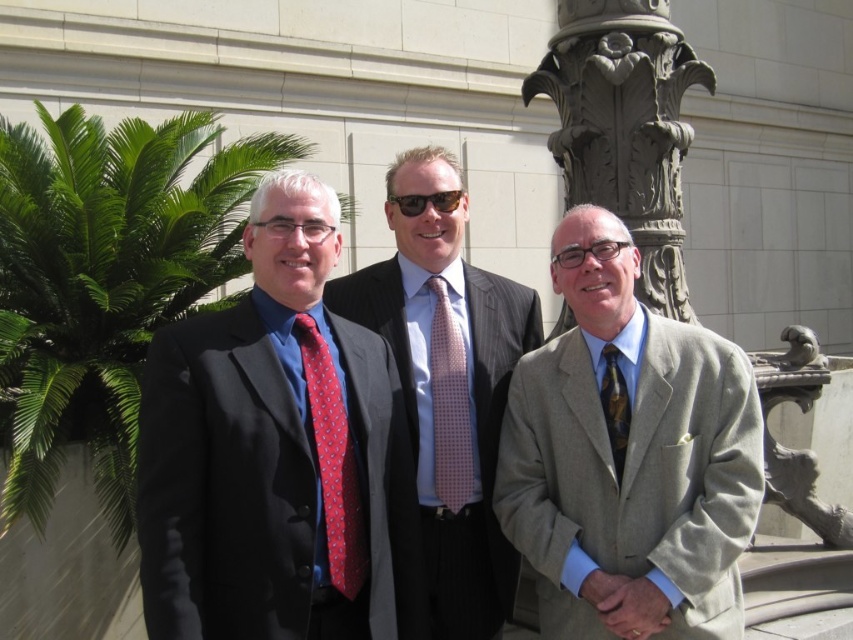
You are standing in front of the classical building and want to place a small statue between the two points, point (39, 476) and point (456, 170). Which point should the statue be closer to in order to be closer to the viewer?

The statue should be closer to point (39, 476) because it is further to the viewer than point (456, 170).